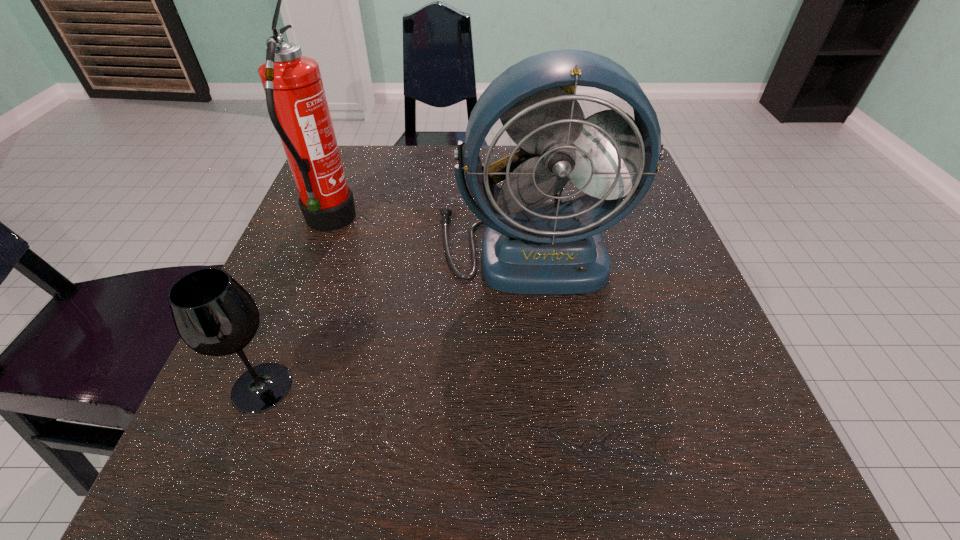
I want to click on object situated at the right edge, so click(x=531, y=248).

At what (x,y) coordinates should I click in order to perform the action: click on object positioned at the far left corner. Please return your answer as a coordinate pair (x, y). The width and height of the screenshot is (960, 540). Looking at the image, I should click on (297, 105).

Image resolution: width=960 pixels, height=540 pixels. Identify the location of vacant space at the far edge of the desktop. (x=444, y=186).

Where is `free space at the near edge of the desktop`? This screenshot has width=960, height=540. free space at the near edge of the desktop is located at coordinates (630, 434).

Identify the location of free space at the left edge. (287, 251).

At what (x,y) coordinates should I click in order to perform the action: click on vacant space at the right edge. Please return your answer as a coordinate pair (x, y). Looking at the image, I should click on (638, 242).

Where is `vacant region at the near left corner of the desktop`? vacant region at the near left corner of the desktop is located at coordinates (248, 439).

This screenshot has height=540, width=960. Identify the location of vacant space at the near right corner of the desktop. (780, 467).

Identify the location of free point between the fire extinguisher and the rightmost object. The height and width of the screenshot is (540, 960). (429, 234).

You are a GUI agent. You are given a task and a screenshot of the screen. Output one action in this format:
    pyautogui.click(x=<x>, y=<y>)
    Task: Click on the free space between the nearest object and the fire extinguisher
    This screenshot has height=540, width=960.
    Given the screenshot: What is the action you would take?
    pyautogui.click(x=296, y=305)